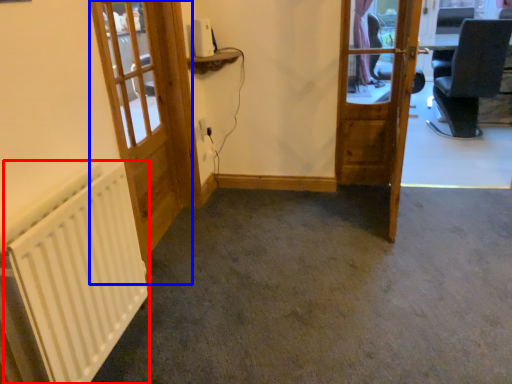
Question: Which point is further to the camera, radiator (highlighted by a red box) or door (highlighted by a blue box)?

Choices:
 (A) radiator
 (B) door

Answer: (B)